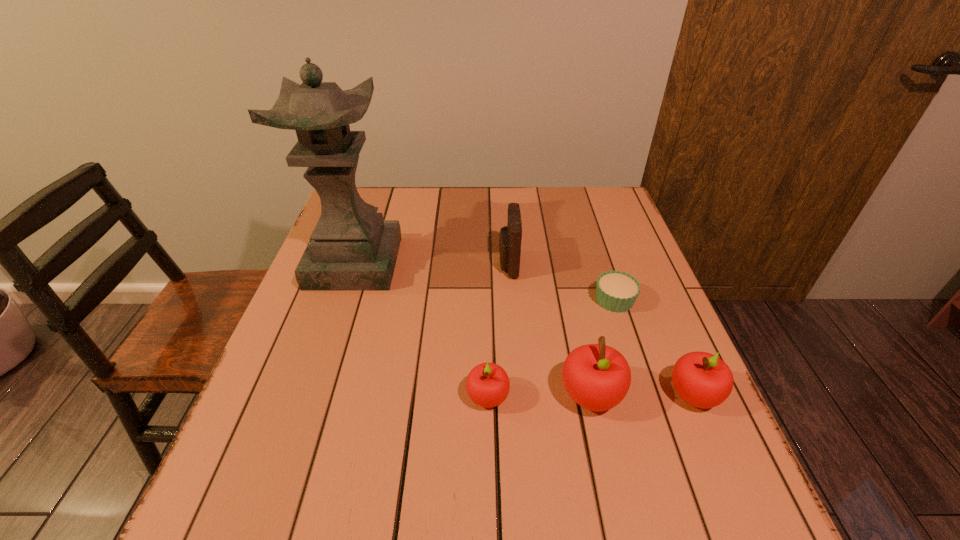
The width and height of the screenshot is (960, 540). Find the location of `object that is positioned at the near right corner`. object that is positioned at the near right corner is located at coordinates (597, 377).

Locate an element on the screen. The height and width of the screenshot is (540, 960). blank space at the far edge is located at coordinates (555, 212).

The image size is (960, 540). In order to click on vacant space at the near edge in this screenshot , I will do `click(562, 469)`.

Where is `vacant region at the left edge`? This screenshot has width=960, height=540. vacant region at the left edge is located at coordinates (325, 376).

Locate an element on the screen. This screenshot has height=540, width=960. free space at the right edge is located at coordinates (650, 379).

This screenshot has width=960, height=540. What are the coordinates of `free space at the near left corner of the desktop` in the screenshot? It's located at (285, 452).

The height and width of the screenshot is (540, 960). I want to click on free space at the far right corner, so click(x=571, y=198).

You are a GUI agent. You are given a task and a screenshot of the screen. Output one action in this format:
    pyautogui.click(x=<x>, y=<y>)
    Task: Click on the vacant space that is in between the second apple from right to left and the leftmost object
    This screenshot has width=960, height=540.
    Given the screenshot: What is the action you would take?
    pyautogui.click(x=473, y=329)

At what (x,y) coordinates should I click in order to perform the action: click on free space between the second apple from left to right and the second tallest apple. Please return your answer as a coordinate pair (x, y). This screenshot has width=960, height=540. Looking at the image, I should click on (642, 395).

This screenshot has height=540, width=960. I want to click on free space between the second apple from right to left and the pouch, so click(x=549, y=330).